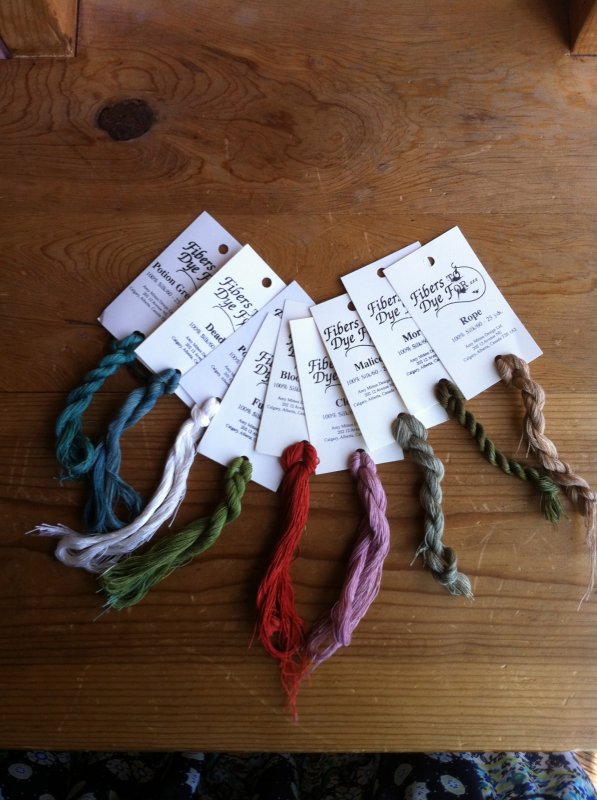
The image size is (597, 800). I want to click on rug, so click(x=530, y=760).